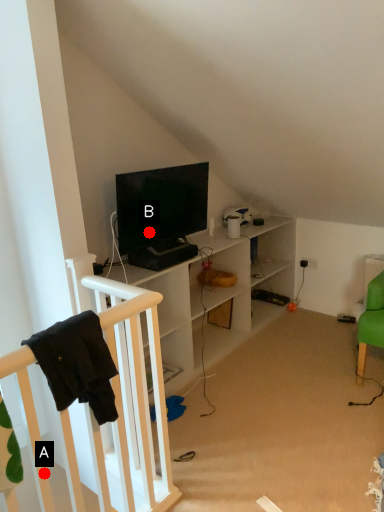
Question: Two points are circled on the image, labeled by A and B beside each circle. Which of the following is the closest to the observer?

Choices:
 (A) A is closer
 (B) B is closer

Answer: (A)